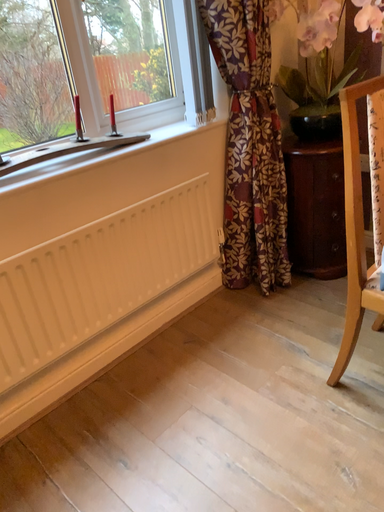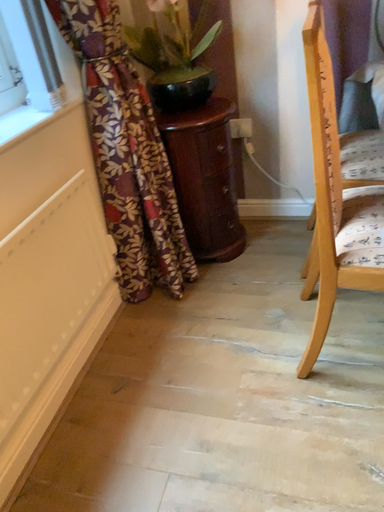
Question: How did the camera likely rotate when shooting the video?

Choices:
 (A) rotated left
 (B) rotated right

Answer: (B)